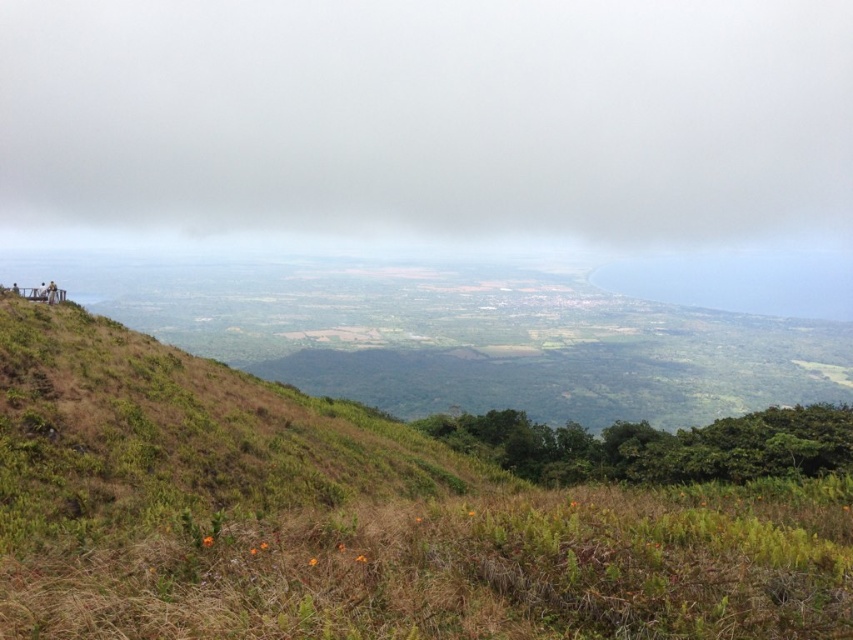
Who is positioned more to the right, white fluffy cloud at upper center or dry grass at lower center?

From the viewer's perspective, dry grass at lower center appears more on the right side.

Between white fluffy cloud at upper center and dry grass at lower center, which one is positioned higher?

white fluffy cloud at upper center is above.

Where is `white fluffy cloud at upper center`? white fluffy cloud at upper center is located at coordinates (428, 116).